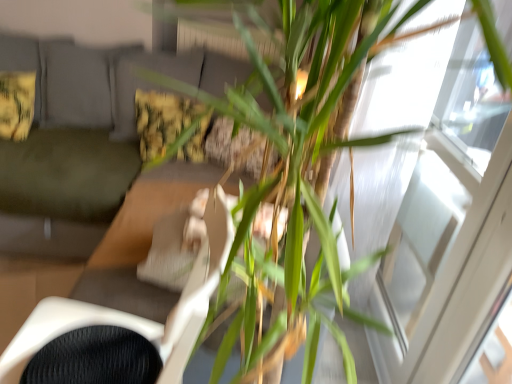
Measure the distance between point (61, 300) and camera.

Point (61, 300) and camera are 1.26 meters apart from each other.

What do you see at coordinates (134, 315) in the screenshot? The width and height of the screenshot is (512, 384). I see `white mesh swivel chair at center` at bounding box center [134, 315].

You are a GUI agent. You are given a task and a screenshot of the screen. Output one action in this format:
    pyautogui.click(x=<x>, y=<y>)
    Task: Click on the transparent glass window at upper right
    The image size is (512, 384).
    Given the screenshot: What is the action you would take?
    pyautogui.click(x=449, y=226)

Locate an element on the screen. The width and height of the screenshot is (512, 384). green leafy plant at center is located at coordinates (469, 272).

Image resolution: width=512 pixels, height=384 pixels. Describe the element at coordinates (169, 125) in the screenshot. I see `fluffy yellow pillow at center, placed as the second pillow when sorted from left to right` at that location.

Image resolution: width=512 pixels, height=384 pixels. What do you see at coordinates (82, 139) in the screenshot? I see `green fabric couch at left` at bounding box center [82, 139].

Find the location of `fluffy yellow pillow at upper left, which is the first pillow from left to right`. fluffy yellow pillow at upper left, which is the first pillow from left to right is located at coordinates (16, 104).

You are a GUI agent. You are given a task and a screenshot of the screen. Output one action in this format:
    pyautogui.click(x=<x>, y=<y>)
    Task: Click on the white mesh swivel chair at center
    
    Given the screenshot: What is the action you would take?
    pyautogui.click(x=134, y=315)

Is fluffy yellow pillow at upper left, the 2th pillow when ordered from right to left, turned away from green leafy plant at center?

No, fluffy yellow pillow at upper left, the 2th pillow when ordered from right to left, is not facing away from green leafy plant at center.

Between fluffy yellow pillow at upper left, which is the first pillow from left to right, and green leafy plant at center, which one has less height?

fluffy yellow pillow at upper left, which is the first pillow from left to right.

Between fluffy yellow pillow at upper left, the 2th pillow when ordered from right to left, and green leafy plant at center, which one has smaller size?

fluffy yellow pillow at upper left, the 2th pillow when ordered from right to left.

From the image's perspective, between fluffy yellow pillow at upper left, which is the first pillow from left to right, and green leafy plant at center, which one is located above?

fluffy yellow pillow at upper left, which is the first pillow from left to right.

Does transparent glass window at upper right come behind green leafy plant at center?

Yes, transparent glass window at upper right is behind green leafy plant at center.

Which of these two, transparent glass window at upper right or green leafy plant at center, is wider?

green leafy plant at center.

From a real-world perspective, which is physically below, transparent glass window at upper right or green leafy plant at center?

green leafy plant at center, from a real-world perspective.

Is fluffy yellow pillow at center, the 1th pillow positioned from the right, to the left of fluffy yellow pillow at upper left, which is the first pillow from left to right, from the viewer's perspective?

No.

Between fluffy yellow pillow at center, the 1th pillow positioned from the right, and fluffy yellow pillow at upper left, which is the first pillow from left to right, which one has more height?

With more height is fluffy yellow pillow at center, the 1th pillow positioned from the right.

Is fluffy yellow pillow at center, the 1th pillow positioned from the right, oriented towards fluffy yellow pillow at upper left, which is the first pillow from left to right?

No, fluffy yellow pillow at center, the 1th pillow positioned from the right, is not turned towards fluffy yellow pillow at upper left, which is the first pillow from left to right.

Identify the location of pillow that appears below the fluffy yellow pillow at upper left, which is the first pillow from left to right (from a real-world perspective). (169, 125).

From a real-world perspective, is fluffy yellow pillow at upper left, which is the first pillow from left to right, above or below fluffy yellow pillow at center, placed as the second pillow when sorted from left to right?

Clearly, from a real-world perspective, fluffy yellow pillow at upper left, which is the first pillow from left to right, is above fluffy yellow pillow at center, placed as the second pillow when sorted from left to right.

Image resolution: width=512 pixels, height=384 pixels. I want to click on pillow lying in front of the fluffy yellow pillow at upper left, the 2th pillow when ordered from right to left, so click(x=169, y=125).

Would you say fluffy yellow pillow at center, placed as the second pillow when sorted from left to right, is part of fluffy yellow pillow at upper left, which is the first pillow from left to right,'s contents?

No, fluffy yellow pillow at center, placed as the second pillow when sorted from left to right, is not a part of fluffy yellow pillow at upper left, which is the first pillow from left to right.

Considering the sizes of fluffy yellow pillow at upper left, the 2th pillow when ordered from right to left, and fluffy yellow pillow at center, the 1th pillow positioned from the right, in the image, is fluffy yellow pillow at upper left, the 2th pillow when ordered from right to left, bigger or smaller than fluffy yellow pillow at center, the 1th pillow positioned from the right,?

In the image, fluffy yellow pillow at upper left, the 2th pillow when ordered from right to left, appears to be smaller than fluffy yellow pillow at center, the 1th pillow positioned from the right.

Considering the sizes of green fabric couch at left and white mesh swivel chair at center in the image, is green fabric couch at left wider or thinner than white mesh swivel chair at center?

In the image, green fabric couch at left appears to be wider than white mesh swivel chair at center.

Does point (197, 65) lie in front of point (205, 276)?

That is False.

Visually, is green fabric couch at left positioned to the left or to the right of white mesh swivel chair at center?

Clearly, green fabric couch at left is on the left of white mesh swivel chair at center in the image.

From the picture: Which is more to the right, fluffy yellow pillow at center, the 1th pillow positioned from the right, or green leafy plant at center?

Positioned to the right is green leafy plant at center.

How much distance is there between fluffy yellow pillow at center, placed as the second pillow when sorted from left to right, and green leafy plant at center?

fluffy yellow pillow at center, placed as the second pillow when sorted from left to right, and green leafy plant at center are 1.08 meters apart.

Considering the relative positions of fluffy yellow pillow at center, placed as the second pillow when sorted from left to right, and green leafy plant at center in the image provided, is fluffy yellow pillow at center, placed as the second pillow when sorted from left to right, in front of green leafy plant at center?

No, fluffy yellow pillow at center, placed as the second pillow when sorted from left to right, is further to the viewer.

Is green leafy plant at center completely or partially inside fluffy yellow pillow at center, placed as the second pillow when sorted from left to right?

No.

Considering the relative sizes of fluffy yellow pillow at center, the 1th pillow positioned from the right, and white mesh swivel chair at center in the image provided, is fluffy yellow pillow at center, the 1th pillow positioned from the right, smaller than white mesh swivel chair at center?

Indeed, fluffy yellow pillow at center, the 1th pillow positioned from the right, has a smaller size compared to white mesh swivel chair at center.

Image resolution: width=512 pixels, height=384 pixels. What are the coordinates of `swivel chair on the right side of fluffy yellow pillow at center, placed as the second pillow when sorted from left to right` in the screenshot? It's located at (134, 315).

In the image, is fluffy yellow pillow at center, placed as the second pillow when sorted from left to right, on the left side or the right side of white mesh swivel chair at center?

Based on their positions, fluffy yellow pillow at center, placed as the second pillow when sorted from left to right, is located to the left of white mesh swivel chair at center.

The width and height of the screenshot is (512, 384). I want to click on houseplant above the fluffy yellow pillow at upper left, the 2th pillow when ordered from right to left (from a real-world perspective), so click(469, 272).

What are the coordinates of `window on the right of green leafy plant at center` in the screenshot? It's located at (449, 226).

From the picture: Which object lies nearer to the anchor point green fabric couch at left, transparent glass window at upper right or white mesh swivel chair at center?

white mesh swivel chair at center is positioned closer to the anchor green fabric couch at left.

Considering their positions, is white mesh swivel chair at center positioned further to fluffy yellow pillow at upper left, which is the first pillow from left to right, than green leafy plant at center?

Among the two, green leafy plant at center is located further to fluffy yellow pillow at upper left, which is the first pillow from left to right.

From the image, which object appears to be farther from transparent glass window at upper right, green leafy plant at center or fluffy yellow pillow at center, the 1th pillow positioned from the right?

fluffy yellow pillow at center, the 1th pillow positioned from the right, lies further to transparent glass window at upper right than the other object.

Considering their positions, is transparent glass window at upper right positioned closer to green leafy plant at center than fluffy yellow pillow at center, placed as the second pillow when sorted from left to right?

transparent glass window at upper right is positioned closer to the anchor green leafy plant at center.

Based on their spatial positions, is fluffy yellow pillow at center, the 1th pillow positioned from the right, or fluffy yellow pillow at upper left, which is the first pillow from left to right, further from green fabric couch at left?

fluffy yellow pillow at center, the 1th pillow positioned from the right, is positioned further to the anchor green fabric couch at left.

Estimate the real-world distances between objects in this image. Which object is closer to green leafy plant at center, fluffy yellow pillow at center, placed as the second pillow when sorted from left to right, or green fabric couch at left?

fluffy yellow pillow at center, placed as the second pillow when sorted from left to right.

From the image, which object appears to be nearer to transparent glass window at upper right, green fabric couch at left or fluffy yellow pillow at center, the 1th pillow positioned from the right?

The object closer to transparent glass window at upper right is fluffy yellow pillow at center, the 1th pillow positioned from the right.

When comparing their distances from white mesh swivel chair at center, does transparent glass window at upper right or green leafy plant at center seem closer?

green leafy plant at center is positioned closer to the anchor white mesh swivel chair at center.

At what (x,y) coordinates should I click in order to perform the action: click on window between green leafy plant at center and fluffy yellow pillow at center, the 1th pillow positioned from the right, along the z-axis. Please return your answer as a coordinate pair (x, y). The height and width of the screenshot is (384, 512). Looking at the image, I should click on (449, 226).

The height and width of the screenshot is (384, 512). Find the location of `pillow between green fabric couch at left and transparent glass window at upper right from left to right`. pillow between green fabric couch at left and transparent glass window at upper right from left to right is located at coordinates (169, 125).

Find the location of a particular element. The width and height of the screenshot is (512, 384). swivel chair situated between green fabric couch at left and green leafy plant at center from left to right is located at coordinates (134, 315).

The height and width of the screenshot is (384, 512). Identify the location of pillow between green leafy plant at center and fluffy yellow pillow at upper left, which is the first pillow from left to right, from front to back. (169, 125).